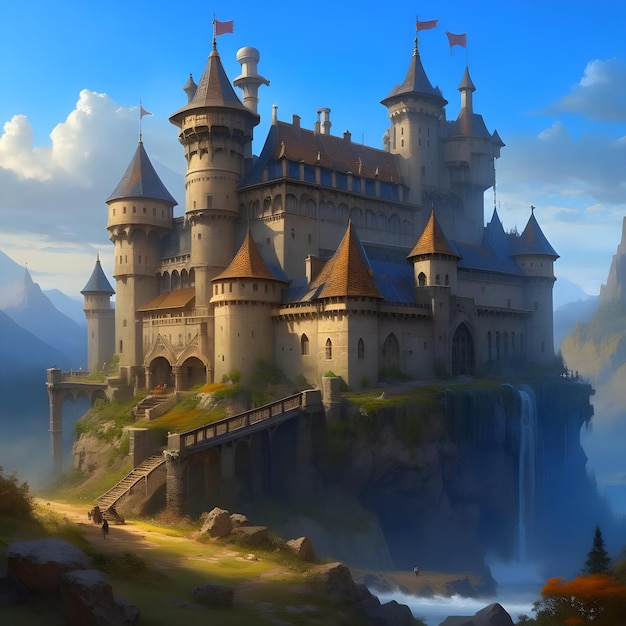
What are the coordinates of `stairs` in the screenshot? It's located at (105, 501), (118, 494), (135, 476), (153, 457).